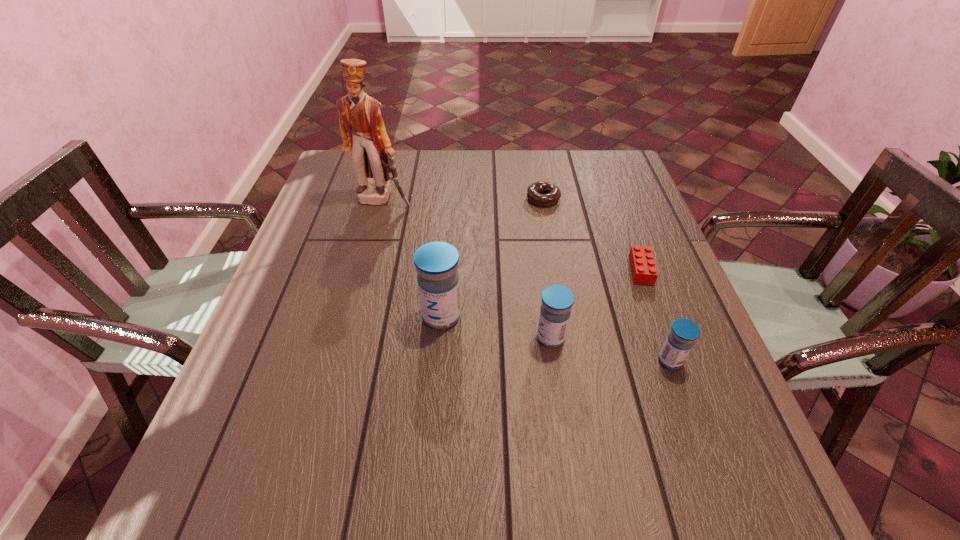
Image resolution: width=960 pixels, height=540 pixels. What are the coordinates of `free location located on the left of the leftmost medicine` in the screenshot? It's located at (338, 316).

Find the location of a particular element. The height and width of the screenshot is (540, 960). vacant space located on the left of the third tallest object is located at coordinates (405, 338).

You are a GUI agent. You are given a task and a screenshot of the screen. Output one action in this format:
    pyautogui.click(x=<x>, y=<y>)
    Task: Click on the blank space located on the back of the shortest medicine
    The width and height of the screenshot is (960, 540).
    Given the screenshot: What is the action you would take?
    pyautogui.click(x=625, y=236)

This screenshot has height=540, width=960. In order to click on vacant space located 0.090m on the right of the doughnut in this screenshot , I will do `click(591, 199)`.

In order to click on vacant space located 0.070m on the front-facing side of the leftmost object in this screenshot , I will do `click(375, 226)`.

Where is `vacant space located 0.400m on the back of the fourth nearest object`? vacant space located 0.400m on the back of the fourth nearest object is located at coordinates (604, 169).

I want to click on doughnut situated at the far edge, so click(x=552, y=194).

Locate an element on the screen. nutcracker present at the far edge is located at coordinates (363, 131).

You are a GUI agent. You are given a task and a screenshot of the screen. Output one action in this format:
    pyautogui.click(x=<x>, y=<y>)
    Task: Click on the object positioned at the left edge
    This screenshot has height=540, width=960.
    Given the screenshot: What is the action you would take?
    pyautogui.click(x=363, y=131)

This screenshot has height=540, width=960. Find the location of `medicine that is at the right edge`. medicine that is at the right edge is located at coordinates (680, 340).